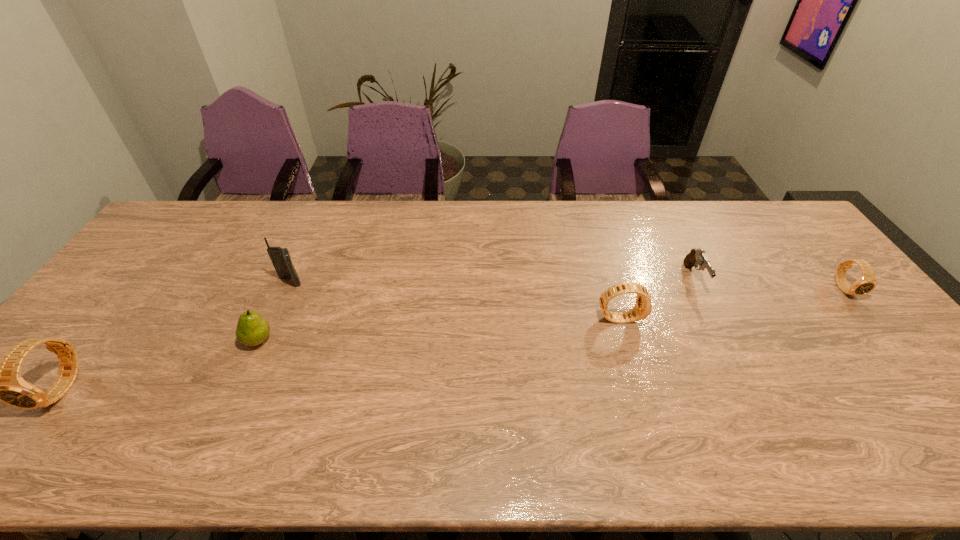
Identify the location of free location located on the face of the farthest watch. click(x=882, y=334).

This screenshot has height=540, width=960. In order to click on vacant space situated on the keyboard of the cellular telephone in this screenshot , I will do `click(278, 308)`.

This screenshot has width=960, height=540. In order to click on vacant area situated at the barrel of the pistol in this screenshot , I will do `click(752, 394)`.

Where is `free space located 0.210m on the right of the pear`? free space located 0.210m on the right of the pear is located at coordinates (352, 340).

I want to click on object that is positioned at the near edge, so click(x=1, y=381).

The width and height of the screenshot is (960, 540). Find the location of `object that is positioned at the left edge`. object that is positioned at the left edge is located at coordinates (1, 381).

You are a GUI agent. You are given a task and a screenshot of the screen. Output one action in this format:
    pyautogui.click(x=<x>, y=<y>)
    Task: Click on the object that is at the right edge
    Image resolution: width=960 pixels, height=540 pixels.
    Given the screenshot: What is the action you would take?
    pyautogui.click(x=867, y=282)

This screenshot has width=960, height=540. Find the location of `object at the near left corner`. object at the near left corner is located at coordinates (1, 381).

You are a GUI agent. You are given a task and a screenshot of the screen. Output one action in this format:
    pyautogui.click(x=<x>, y=<y>)
    Task: Click on the free space at the far edge of the desktop
    The width and height of the screenshot is (960, 540).
    Given the screenshot: What is the action you would take?
    pyautogui.click(x=258, y=229)

Locate an element on the screen. This screenshot has height=540, width=960. free region at the near edge of the desktop is located at coordinates (573, 417).